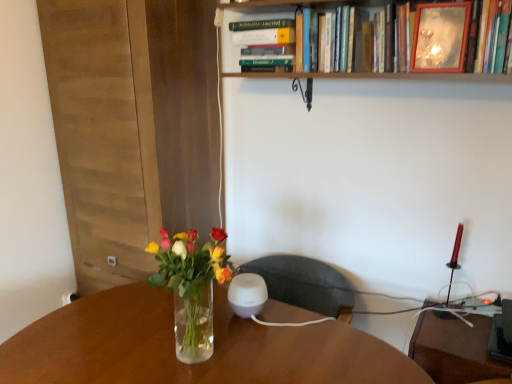
Question: Considering the positions of hardcover book at upper center, which ranks as the 1th book in left-to-right order, and wooden picture frame at upper right in the image, is hardcover book at upper center, which ranks as the 1th book in left-to-right order, taller or shorter than wooden picture frame at upper right?

Choices:
 (A) tall
 (B) short

Answer: (B)

Question: From the image's perspective, is hardcover book at upper center, which ranks as the 1th book in left-to-right order, above or below wooden picture frame at upper right?

Choices:
 (A) above
 (B) below

Answer: (A)

Question: Considering the real-world distances, which object is closest to the wooden picture frame at upper right?

Choices:
 (A) wooden frame mirror at upper center, positioned as the 2th book in left-to-right order
 (B) translucent glass vase at center
 (C) hardcover book at upper center, which ranks as the 1th book in left-to-right order

Answer: (A)

Question: Estimate the real-world distances between objects in this image. Which object is farther from the wooden frame mirror at upper center, positioned as the 2th book in left-to-right order?

Choices:
 (A) hardcover book at upper center, the second book viewed from the right
 (B) wooden picture frame at upper right
 (C) translucent glass vase at center

Answer: (C)